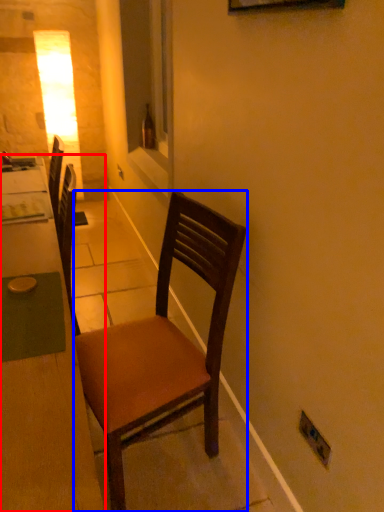
Question: Which object is closer to the camera taking this photo, desk (highlighted by a red box) or chair (highlighted by a blue box)?

Choices:
 (A) desk
 (B) chair

Answer: (A)